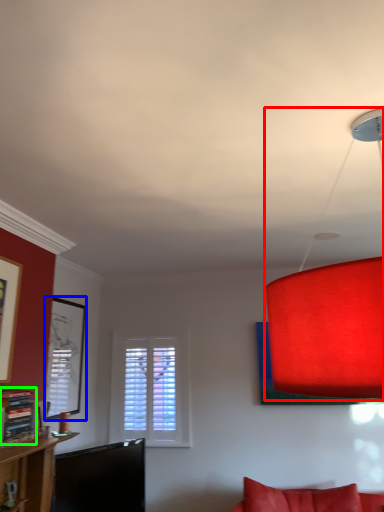
Question: Which is nearer to the lamp (highlighted by a red box)? picture frame (highlighted by a blue box) or shelf (highlighted by a green box).

Choices:
 (A) picture frame
 (B) shelf

Answer: (B)